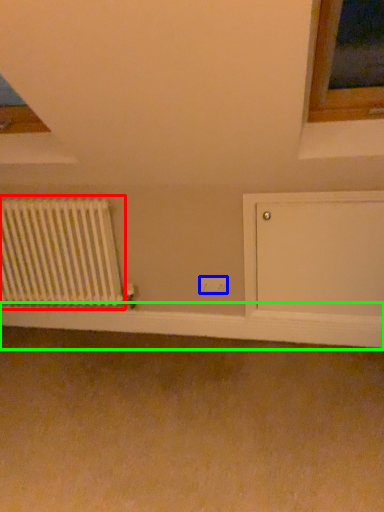
Question: Which object is positioned closest to radiator (highlighted by a red box)? Select from electric outlet (highlighted by a blue box) and window sill (highlighted by a green box).

Choices:
 (A) electric outlet
 (B) window sill

Answer: (B)